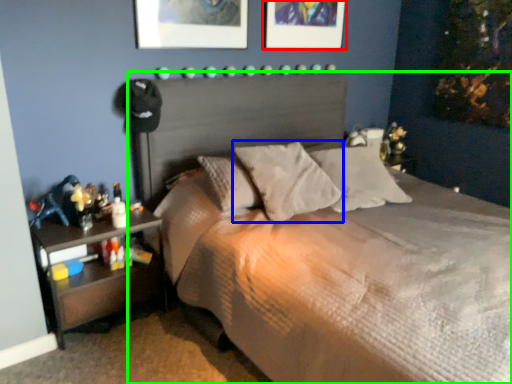
Question: Which object is the closest to the picture frame (highlighted by a red box)? Choose among these: pillow (highlighted by a blue box) or bed (highlighted by a green box).

Choices:
 (A) pillow
 (B) bed

Answer: (A)